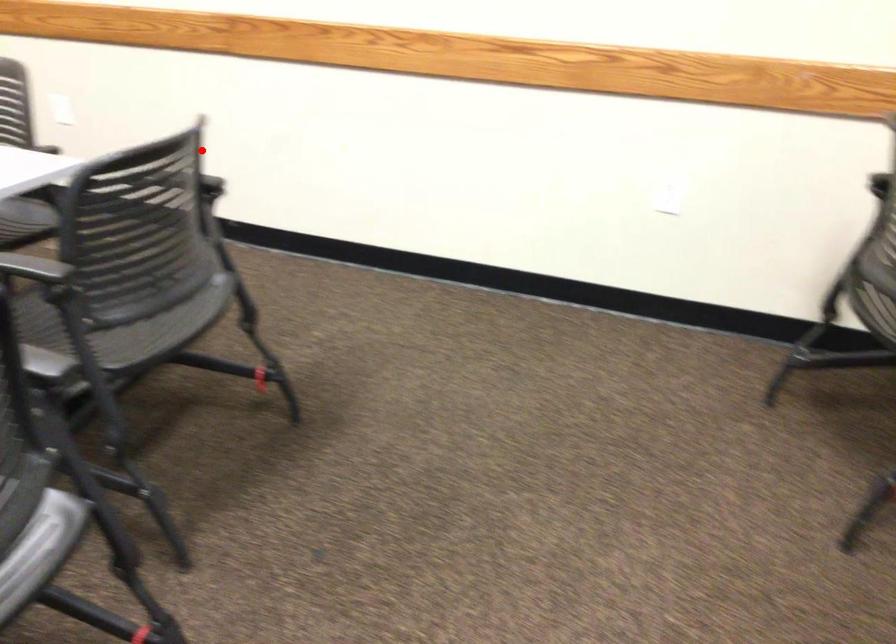
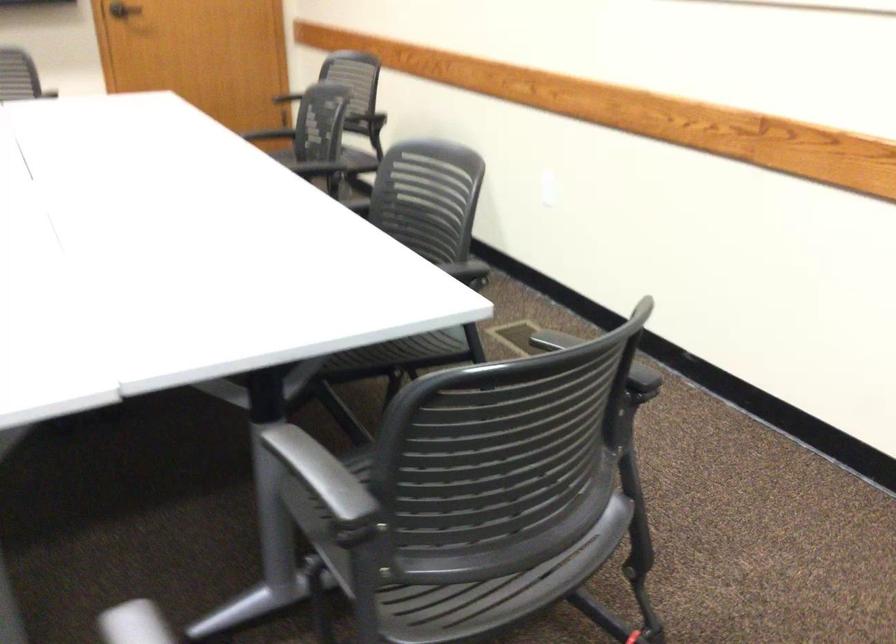
Question: I am providing you with two images of the same scene from different viewpoints. In image1, a red point is highlighted. Considering the same 3D point in image2, which of the following is correct?

Choices:
 (A) It is closer
 (B) It is farther

Answer: (A)